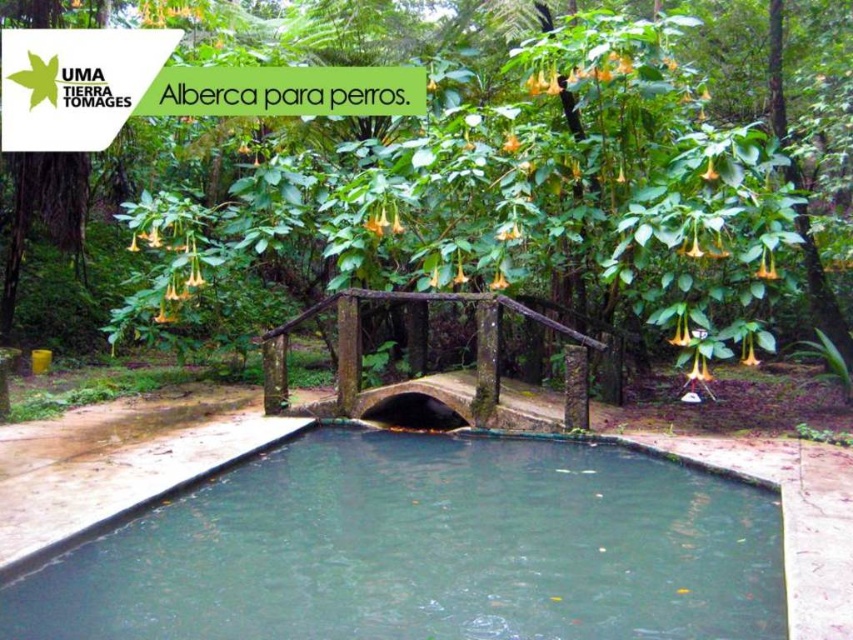
You are a landscape architect designing a new garden. You need to place a statue that requires a 3 meters wide base. The statue must be placed either on the clear water at center or under the green leafy tree at center. Which location has enough space for the statue?

The clear water at center has a greater width than the green leafy tree at center, so the statue can be placed on the clear water at center as it provides sufficient space for the 3 meters wide base.

You are a bird flying over the clear water at center and the green leafy tree at center. Which object is above the other?

The green leafy tree at center is above the clear water at center.